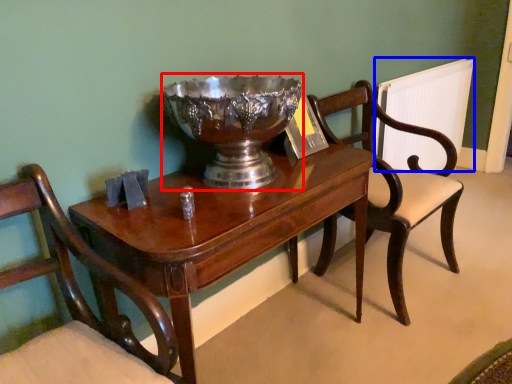
Question: Which object is closer to the camera taking this photo, bowl (highlighted by a red box) or radiator (highlighted by a blue box)?

Choices:
 (A) bowl
 (B) radiator

Answer: (A)